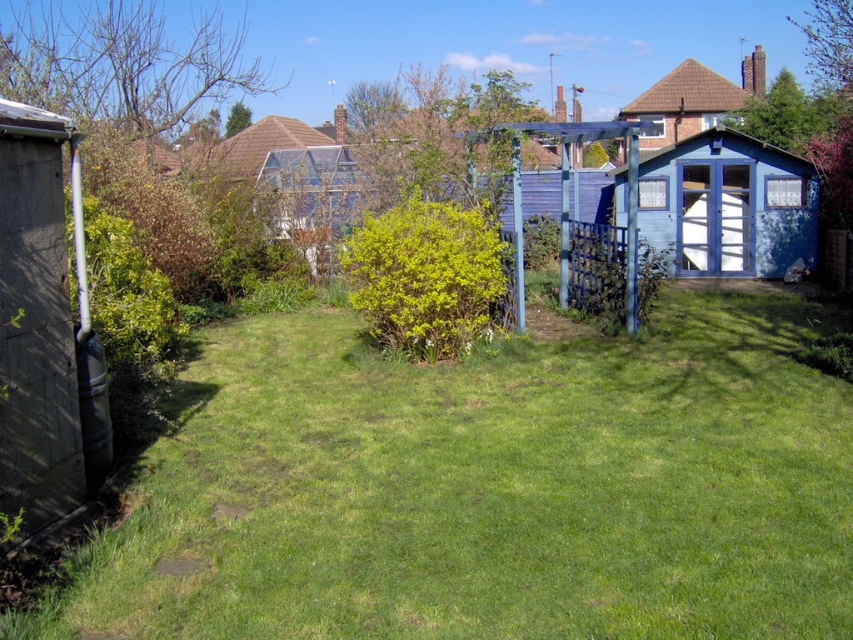
You are standing in the backyard and want to place a new garden bench. You have two options based on the scene. The first option is to place it on the green grass at center, and the second is near the brown tiled roof at upper center. Which location is to the right when facing the scene?

The green grass at center is to the right of the brown tiled roof at upper center, so placing the bench on the green grass at center would be to the right when facing the scene.

You are standing in the suburban backyard and want to find the green grass at center. Based on the coordinates provided, where should you look?

The green grass at center is located at point (486, 488), so you should look towards the lower right area of the image since lower coordinates typically indicate downward positions in image coordinate systems.